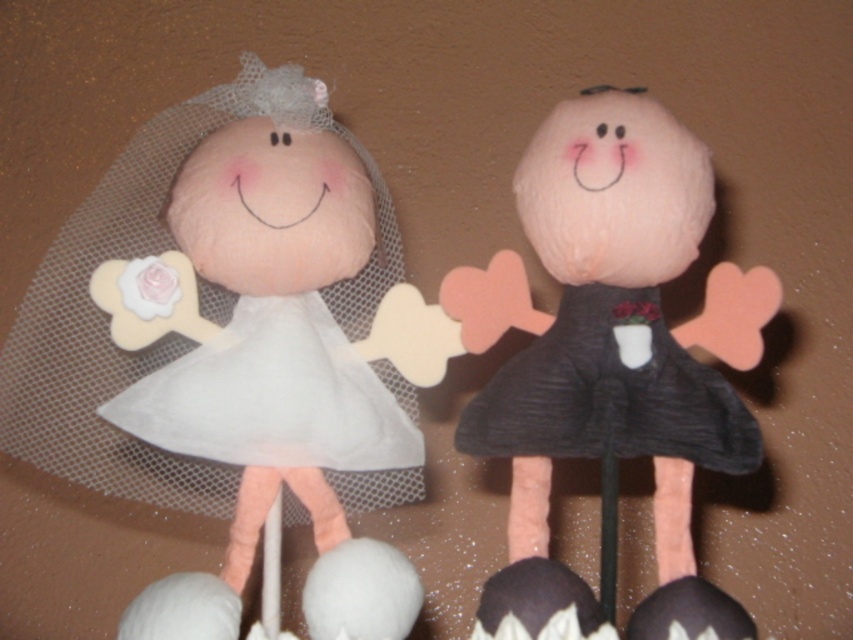
Question: Based on their relative distances, which object is farther from the white fabric doll at left?

Choices:
 (A) white fabric dress at left
 (B) dark gray textured dress at right
 (C) matte black dress at right

Answer: (B)

Question: Which of the following is the closest to the observer?

Choices:
 (A) (618, 372)
 (B) (288, 444)
 (C) (541, 461)

Answer: (B)

Question: Among these points, which one is farthest from the camera?

Choices:
 (A) (726, 317)
 (B) (320, 340)
 (C) (662, 452)
 (D) (132, 621)

Answer: (B)

Question: Does matte black dress at right appear on the left side of white fabric dress at left?

Choices:
 (A) yes
 (B) no

Answer: (B)

Question: Can you confirm if white fabric doll at left is smaller than dark gray textured dress at right?

Choices:
 (A) yes
 (B) no

Answer: (B)

Question: Can you confirm if matte black dress at right is wider than dark gray textured dress at right?

Choices:
 (A) no
 (B) yes

Answer: (B)